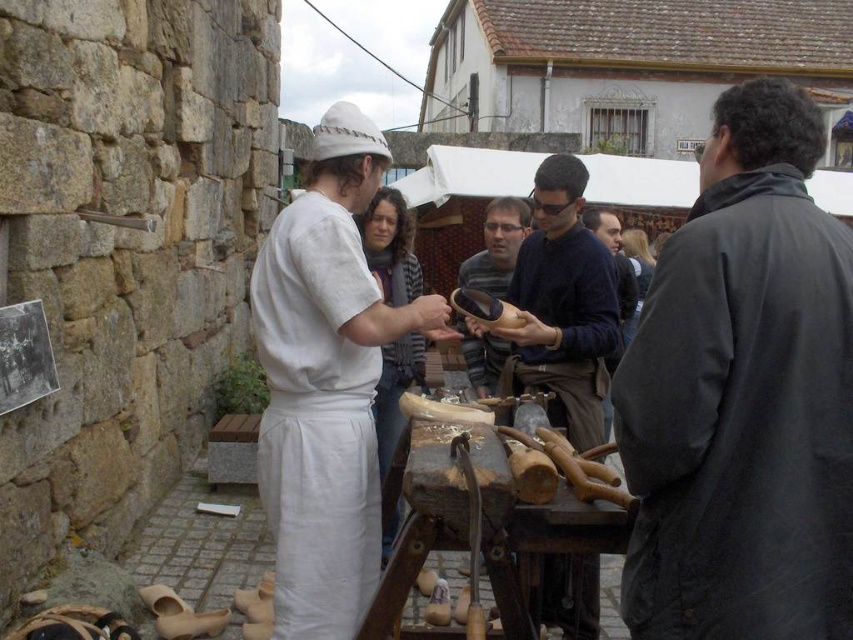
Which is in front, point (642, 368) or point (552, 573)?

Point (642, 368)

Who is more distant from viewer, (733,104) or (567,156)?

The point (567,156) is behind.

Is point (837, 289) farther from viewer compared to point (552, 387)?

No, it is in front of (552, 387).

You are a GUI agent. You are given a task and a screenshot of the screen. Output one action in this format:
    pyautogui.click(x=<x>, y=<y>)
    Task: Click on the dark gray jacket at right
    
    Given the screenshot: What is the action you would take?
    pyautogui.click(x=743, y=396)

Who is more distant from viewer, (627, 550) or (485, 388)?

The point (485, 388) is behind.

Which of these two, dark gray jacket at right or wooden shoe at center, stands shorter?

wooden shoe at center is shorter.

Where is `dark gray jacket at right`? dark gray jacket at right is located at coordinates (743, 396).

Which is in front, point (717, 586) or point (306, 564)?

Point (717, 586)

Does point (825, 339) lie in front of point (282, 529)?

Yes, it is in front of point (282, 529).

Find the location of a particular element. dark gray jacket at right is located at coordinates (743, 396).